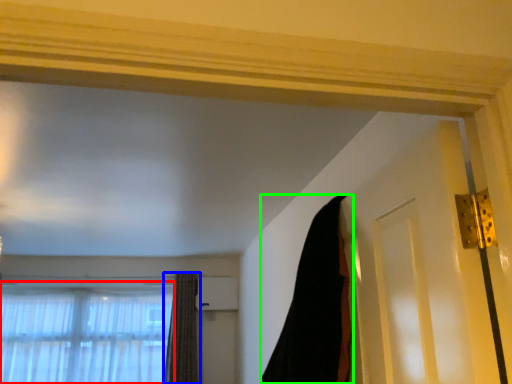
Question: Which is farther away from window (highlighted by a red box)? curtain (highlighted by a blue box) or curtain (highlighted by a green box)?

Choices:
 (A) curtain
 (B) curtain

Answer: (B)